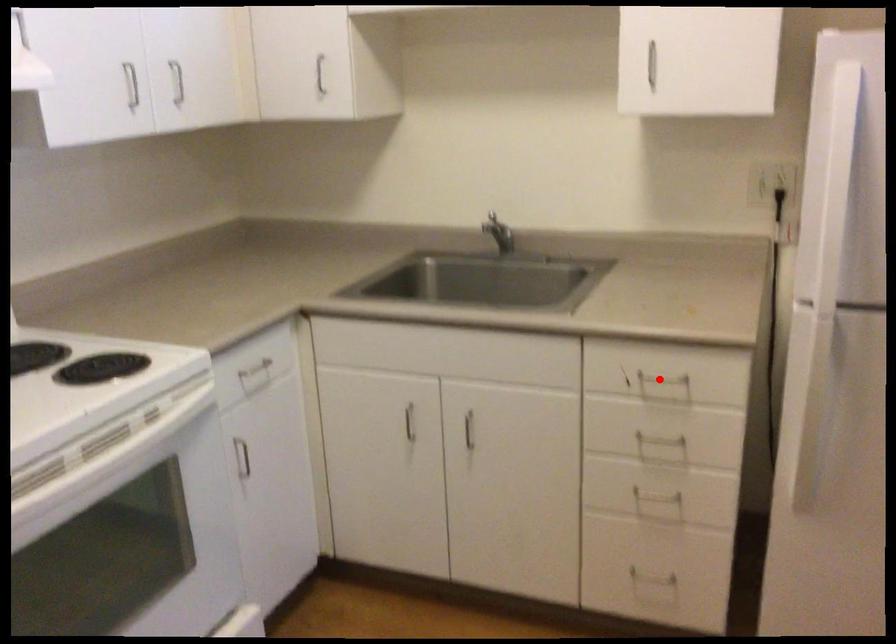
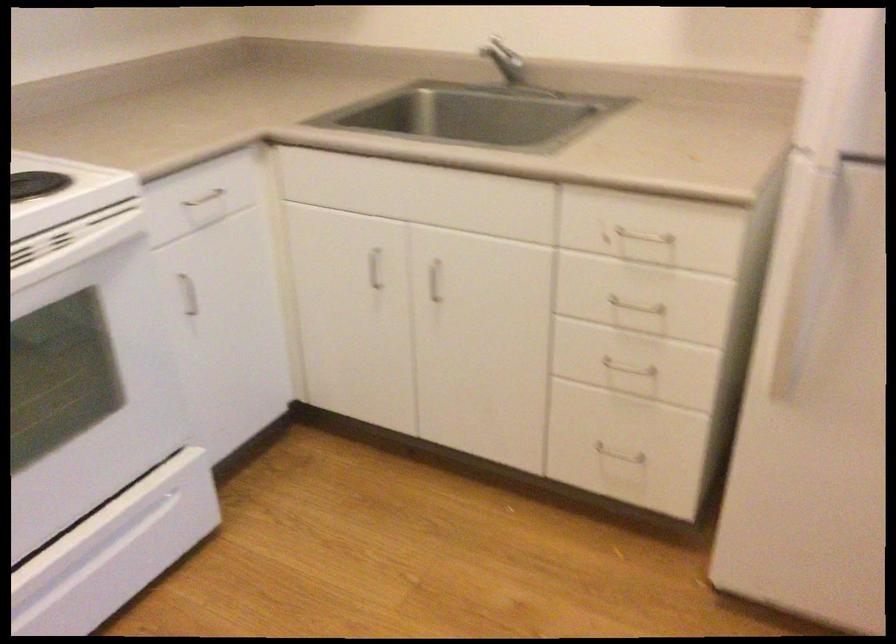
Question: I am providing you with two images of the same scene from different viewpoints. A red point is marked on the first image. Is the red point's position out of view in image 2?

Choices:
 (A) Yes
 (B) No

Answer: (B)